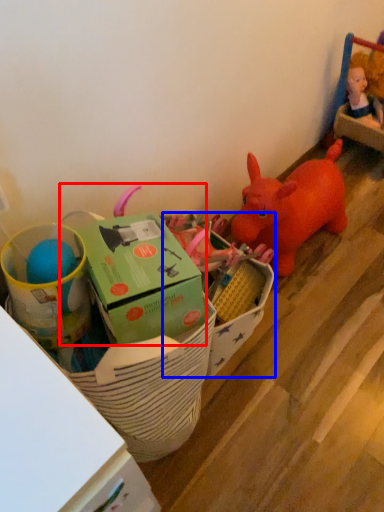
Question: Which object appears closest to the camera in this image, toy (highlighted by a red box) or storage box (highlighted by a blue box)?

Choices:
 (A) toy
 (B) storage box

Answer: (A)